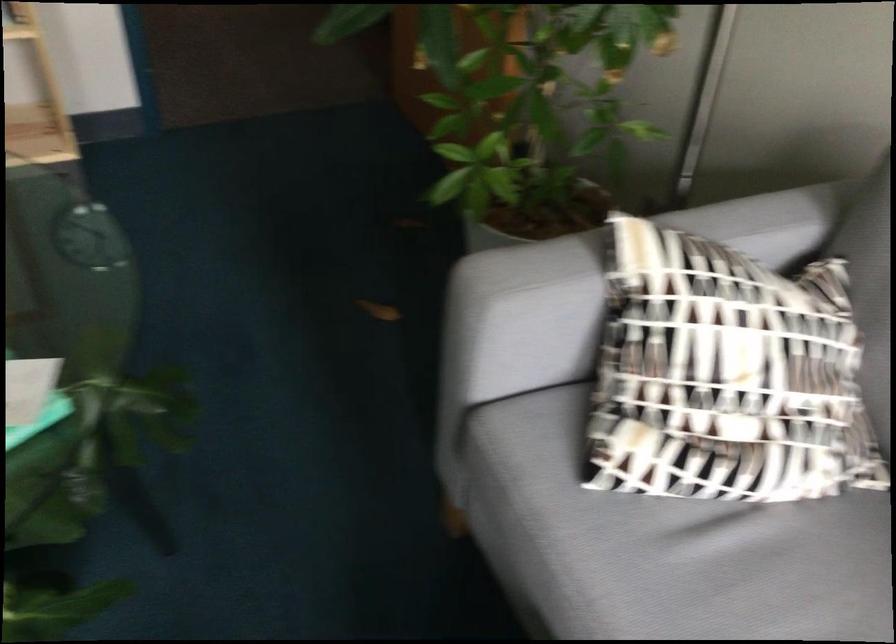
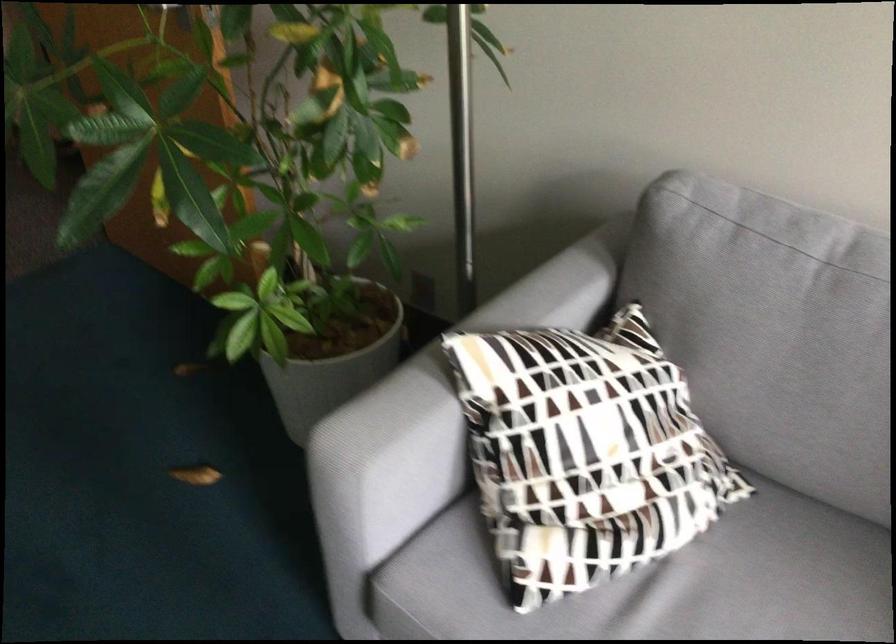
Locate, in the second image, the point that corresponds to the point at 714,368 in the first image.

(583, 453)